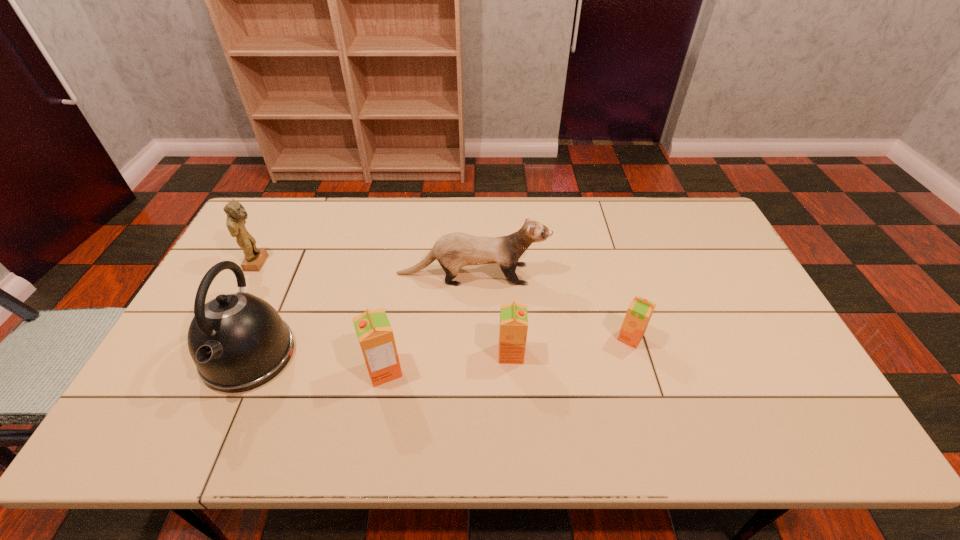
Locate an element on the screen. This screenshot has width=960, height=540. vacant area located 0.170m on the face of the ferret is located at coordinates (602, 274).

At what (x,y) coordinates should I click in order to perform the action: click on vacant space situated on the front-facing side of the figurine. Please return your answer as a coordinate pair (x, y). Looking at the image, I should click on tap(381, 263).

I want to click on orange juice present at the near edge, so click(374, 332).

The width and height of the screenshot is (960, 540). I want to click on kettle present at the near edge, so click(238, 341).

The height and width of the screenshot is (540, 960). I want to click on figurine that is at the left edge, so click(x=254, y=258).

At what (x,y) coordinates should I click in order to perform the action: click on kettle that is at the left edge. Please return your answer as a coordinate pair (x, y). Looking at the image, I should click on (238, 341).

Identify the location of object that is at the near left corner. The width and height of the screenshot is (960, 540). (238, 341).

At what (x,y) coordinates should I click in order to perform the action: click on vacant space at the far edge. Please return your answer as a coordinate pair (x, y). Image resolution: width=960 pixels, height=540 pixels. Looking at the image, I should click on (555, 214).

Find the location of a particular element. The height and width of the screenshot is (540, 960). vacant space at the near edge is located at coordinates (622, 388).

This screenshot has width=960, height=540. What are the coordinates of `vacant point at the right edge` in the screenshot? It's located at (715, 288).